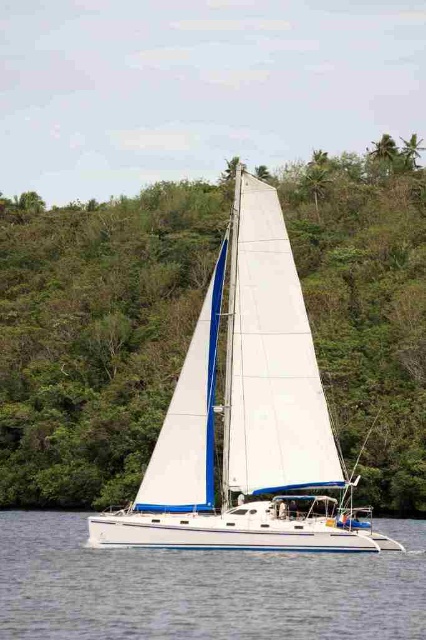
You are an observer standing on the shore looking at the white matte sailboat at center and the white glossy water at center. Which object appears taller from your perspective?

The white matte sailboat at center appears taller than the white glossy water at center because the sailboat has a greater height compared to the water.

You are an observer standing on the shore looking at the white matte sailboat at center and the white glossy water at center. Which object appears narrower from your perspective?

The white matte sailboat at center appears narrower compared to the white glossy water at center as it has a lesser width.